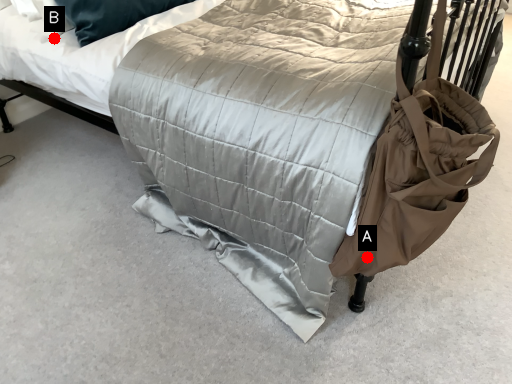
Question: Two points are circled on the image, labeled by A and B beside each circle. Which point is closer to the camera taking this photo?

Choices:
 (A) A is closer
 (B) B is closer

Answer: (A)